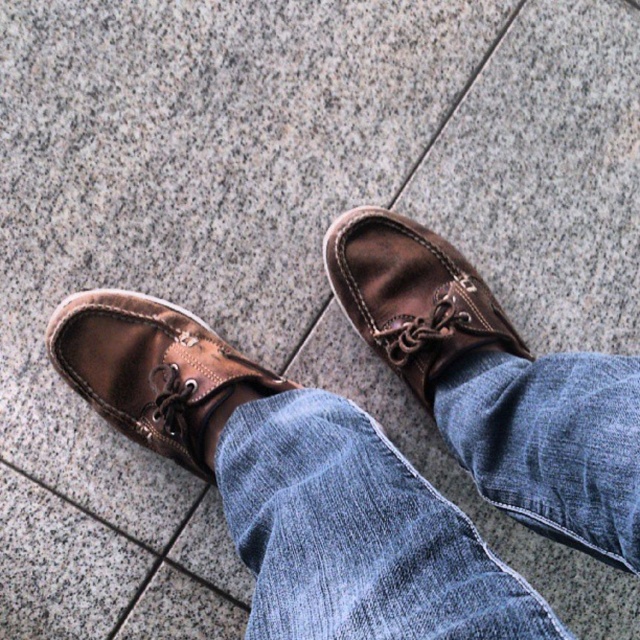
Between denim at center and brown leather shoe at center, which one is positioned higher?

brown leather shoe at center

Is point (500, 438) positioned after point (96, 362)?

No, (500, 438) is closer to viewer.

What are the coordinates of `denim at center` in the screenshot? It's located at (356, 532).

Does brown leather shoe at center appear over leather shoe at center?

No.

Is brown leather shoe at center shorter than leather shoe at center?

Correct, brown leather shoe at center is not as tall as leather shoe at center.

Is point (278, 380) positioned after point (362, 253)?

No, (278, 380) is in front of (362, 253).

Where is `brown leather shoe at center`? brown leather shoe at center is located at coordinates (152, 371).

Find the location of `denim at center`. denim at center is located at coordinates (356, 532).